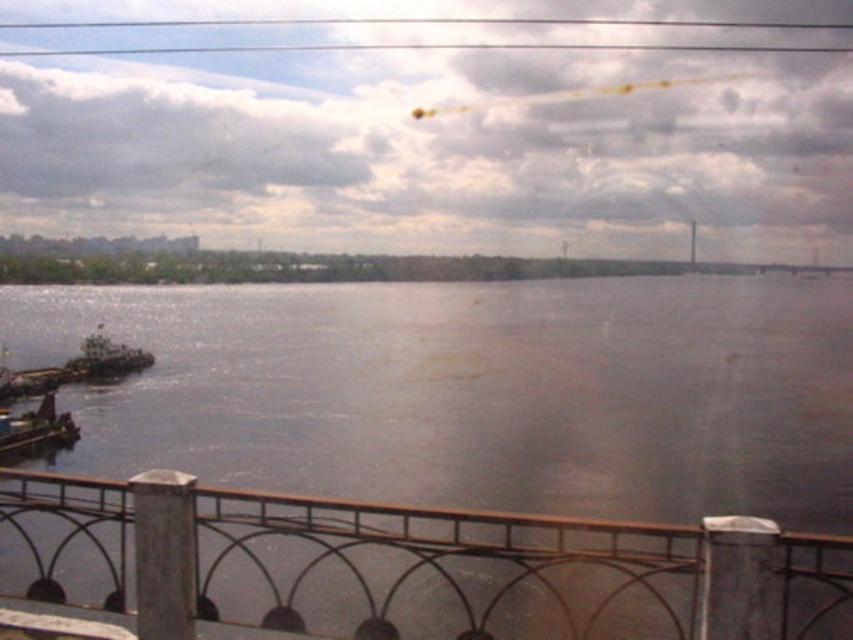
Question: Observing the image, what is the correct spatial positioning of wooden boat at lower left in reference to white matte boat at left?

Choices:
 (A) above
 (B) below

Answer: (B)

Question: Does dark brown water at center lie in front of wooden boat at lower left?

Choices:
 (A) no
 (B) yes

Answer: (B)

Question: Considering the real-world distances, which object is closest to the wooden boat at lower left?

Choices:
 (A) dark brown water at center
 (B) white matte boat at left
 (C) metallic gray railing at lower center

Answer: (B)

Question: Which object appears farthest from the camera in this image?

Choices:
 (A) dark brown water at center
 (B) wooden boat at lower left

Answer: (B)

Question: Does metallic gray railing at lower center appear on the left side of wooden boat at lower left?

Choices:
 (A) no
 (B) yes

Answer: (A)

Question: Which of the following is the closest to the observer?

Choices:
 (A) metallic gray railing at lower center
 (B) white matte boat at left
 (C) wooden boat at lower left

Answer: (A)